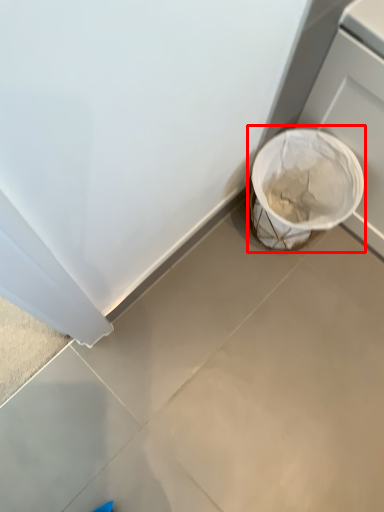
Question: From the image, what is the correct spatial relationship of waste container (annotated by the red box) in relation to concrete?

Choices:
 (A) left
 (B) right

Answer: (B)